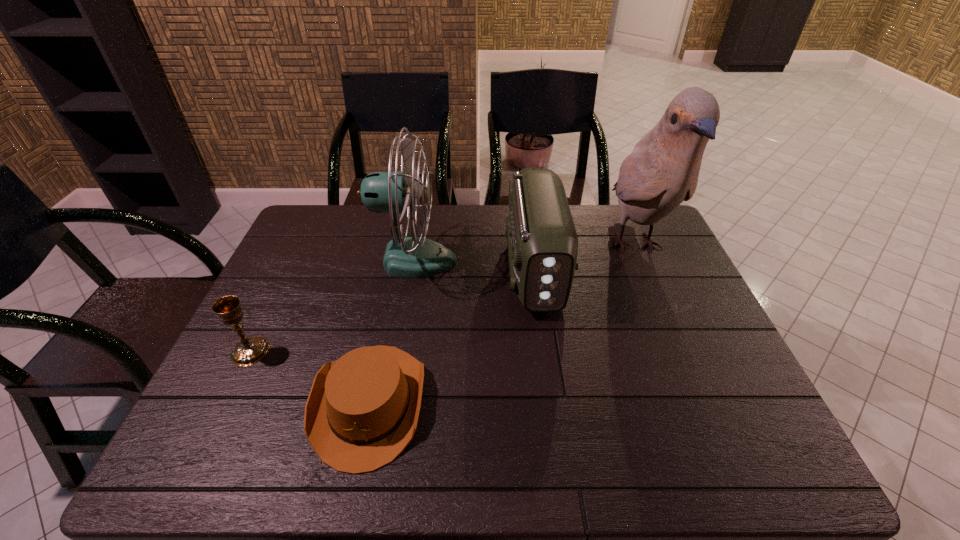
This screenshot has height=540, width=960. I want to click on parakeet, so click(662, 171).

The image size is (960, 540). I want to click on the tallest object, so click(662, 171).

Where is `fan`? The width and height of the screenshot is (960, 540). fan is located at coordinates (393, 192).

Find the location of a particular element. The width and height of the screenshot is (960, 540). the fourth object from left to right is located at coordinates (542, 242).

This screenshot has height=540, width=960. Find the location of `radio_receiver`. radio_receiver is located at coordinates (542, 242).

Locate an element on the screen. Image resolution: width=960 pixels, height=540 pixels. the second shortest object is located at coordinates (251, 350).

At what (x,y) coordinates should I click in order to perform the action: click on the leftmost object. Please return your answer as a coordinate pair (x, y). The height and width of the screenshot is (540, 960). Looking at the image, I should click on (251, 350).

The image size is (960, 540). I want to click on cowboy hat, so click(x=362, y=411).

Identify the location of free region located on the face of the tallest object. This screenshot has height=540, width=960. (670, 330).

In order to click on vacant space located in front of the fan, directing airflow in this screenshot , I will do tap(533, 260).